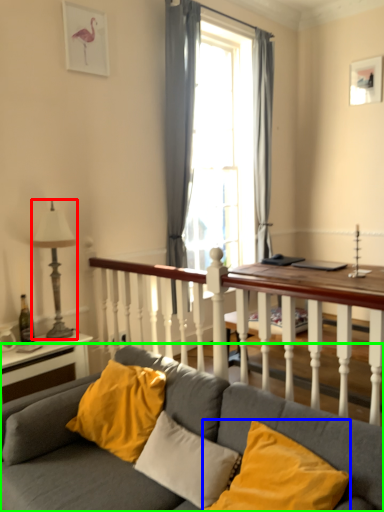
Question: Based on their relative distances, which object is nearer to lamp (highlighted by a red box)? Choose from pillow (highlighted by a blue box) and studio couch (highlighted by a green box).

Choices:
 (A) pillow
 (B) studio couch

Answer: (B)